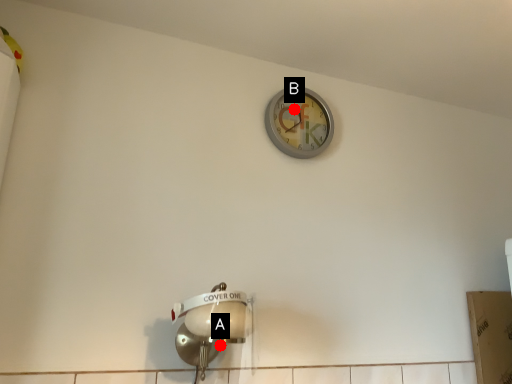
Question: Two points are circled on the image, labeled by A and B beside each circle. Which point is farther from the camera taking this photo?

Choices:
 (A) A is further
 (B) B is further

Answer: (B)